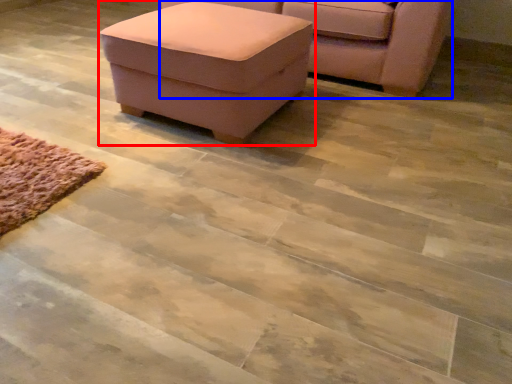
Question: Among these objects, which one is farthest to the camera, table (highlighted by a red box) or chair (highlighted by a blue box)?

Choices:
 (A) table
 (B) chair

Answer: (B)